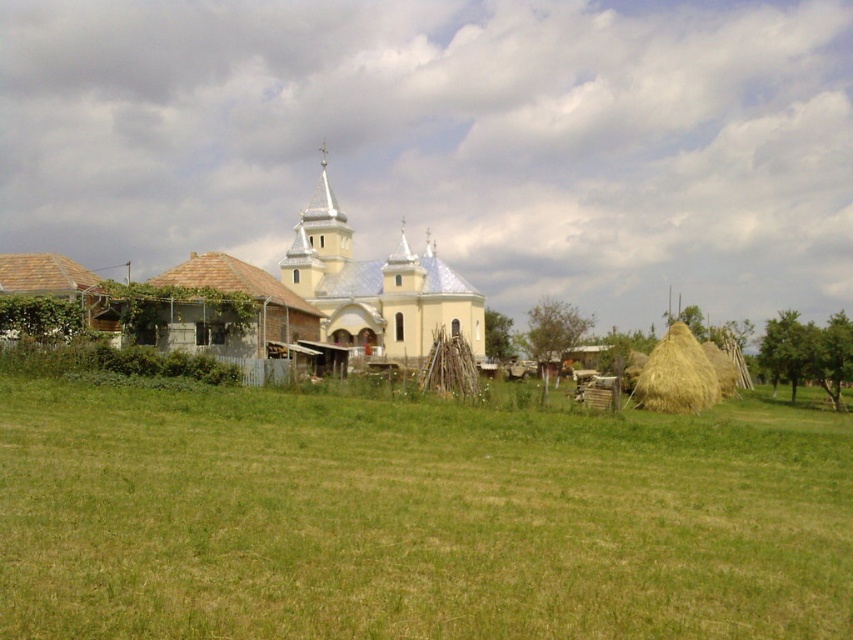
Is yellow matte church at center above brown shingled hut at lower left?

Incorrect, yellow matte church at center is not positioned above brown shingled hut at lower left.

Find the location of a particular element. yellow matte church at center is located at coordinates (273, 301).

Who is shorter, brown shingled hut at lower left or yellow straw stack at right?

yellow straw stack at right is shorter.

Who is positioned more to the right, brown shingled hut at lower left or yellow straw stack at right?

yellow straw stack at right is more to the right.

Between point (39, 304) and point (654, 352), which one is positioned in front?

Positioned in front is point (39, 304).

Find the location of a particular element. brown shingled hut at lower left is located at coordinates tap(50, 298).

Is yellow metallic church at center positioned at the back of brown shingled hut at lower left?

Yes, yellow metallic church at center is further from the viewer.

Who is positioned more to the left, yellow metallic church at center or brown shingled hut at lower left?

Positioned to the left is brown shingled hut at lower left.

Locate an element on the screen. This screenshot has width=853, height=640. yellow metallic church at center is located at coordinates (376, 288).